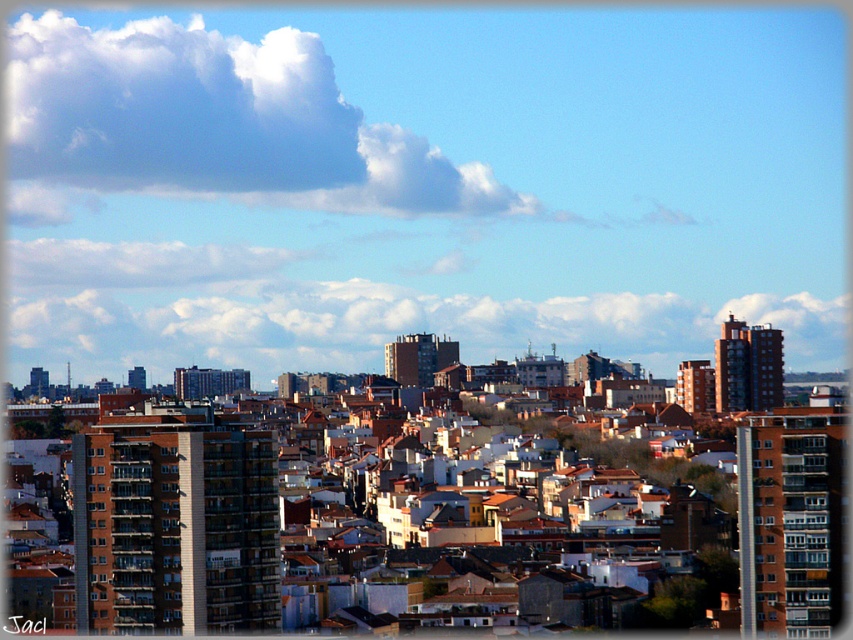
Is matte concrete buildings at center closer to camera compared to white fluffy cloud at upper center?

Yes, it is in front of white fluffy cloud at upper center.

Does point (809, 140) come farther from viewer compared to point (457, 202)?

Yes, point (809, 140) is farther from viewer.

Consider the image. Who is more forward, [123,292] or [486,198]?

Positioned in front is point [486,198].

Identify the location of matte concrete buildings at center. (421, 184).

Which is more to the right, white fluffy cloud at upper center or white fluffy cloud at center?

white fluffy cloud at center

Where is `white fluffy cloud at upper center`? The width and height of the screenshot is (853, 640). white fluffy cloud at upper center is located at coordinates (213, 125).

The image size is (853, 640). What do you see at coordinates (421, 184) in the screenshot?
I see `matte concrete buildings at center` at bounding box center [421, 184].

Which is behind, point (807, 292) or point (86, 352)?

Point (807, 292)

At what (x,y) coordinates should I click in order to perform the action: click on matte concrete buildings at center. Please return your answer as a coordinate pair (x, y). Looking at the image, I should click on tap(421, 184).